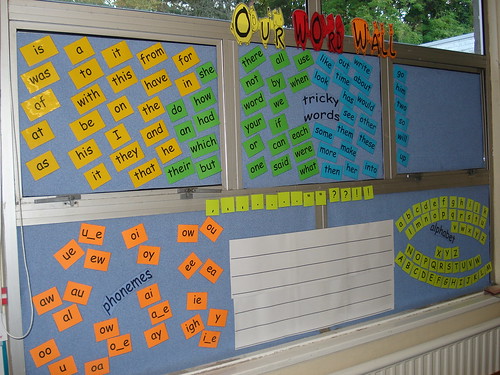
Identify the location of window sill. (337, 344).